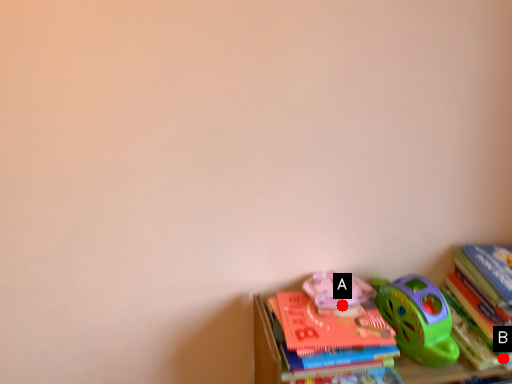
Question: Two points are circled on the image, labeled by A and B beside each circle. Which point is further to the camera?

Choices:
 (A) A is further
 (B) B is further

Answer: (A)